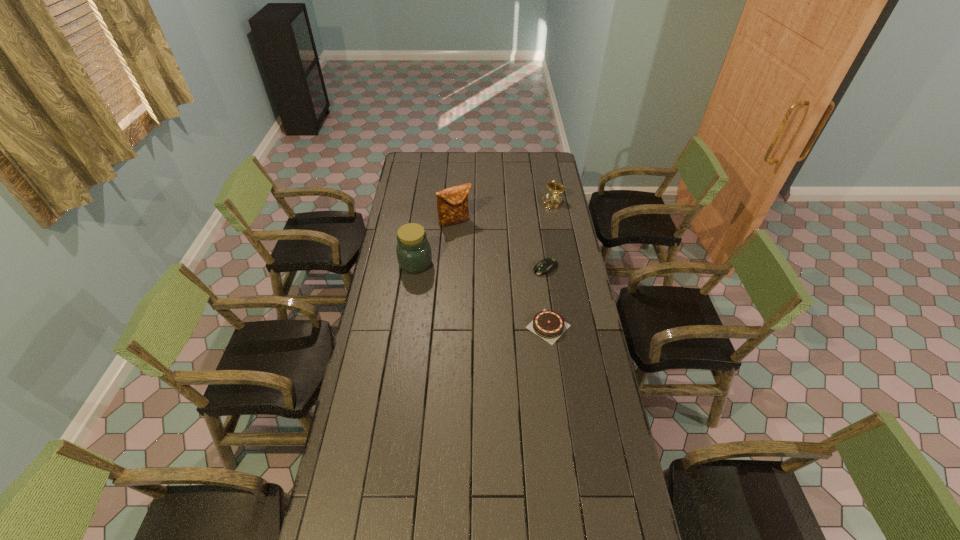
Locate an element on the screen. This screenshot has width=960, height=540. jar is located at coordinates (413, 250).

Identify the location of chocolate cake. (549, 325).

Locate an element on the screen. the second object from left to right is located at coordinates (452, 203).

The height and width of the screenshot is (540, 960). I want to click on the fourth nearest object, so click(x=452, y=203).

You are a GUI agent. You are given a task and a screenshot of the screen. Output one action in this format:
    pyautogui.click(x=<x>, y=<y>)
    Task: Click on the computer mouse
    
    Given the screenshot: What is the action you would take?
    (547, 265)

Where is `compass`? Image resolution: width=960 pixels, height=540 pixels. compass is located at coordinates (552, 200).

Identify the location of the third tallest object. The height and width of the screenshot is (540, 960). (552, 200).

Where is `vacant space located 0.130m on the front of the jar`? vacant space located 0.130m on the front of the jar is located at coordinates (411, 297).

The width and height of the screenshot is (960, 540). In order to click on free space located on the back of the nearest object in this screenshot , I will do `click(543, 293)`.

Where is `free location located 0.300m on the open side of the clutch bag`? The height and width of the screenshot is (540, 960). free location located 0.300m on the open side of the clutch bag is located at coordinates (481, 267).